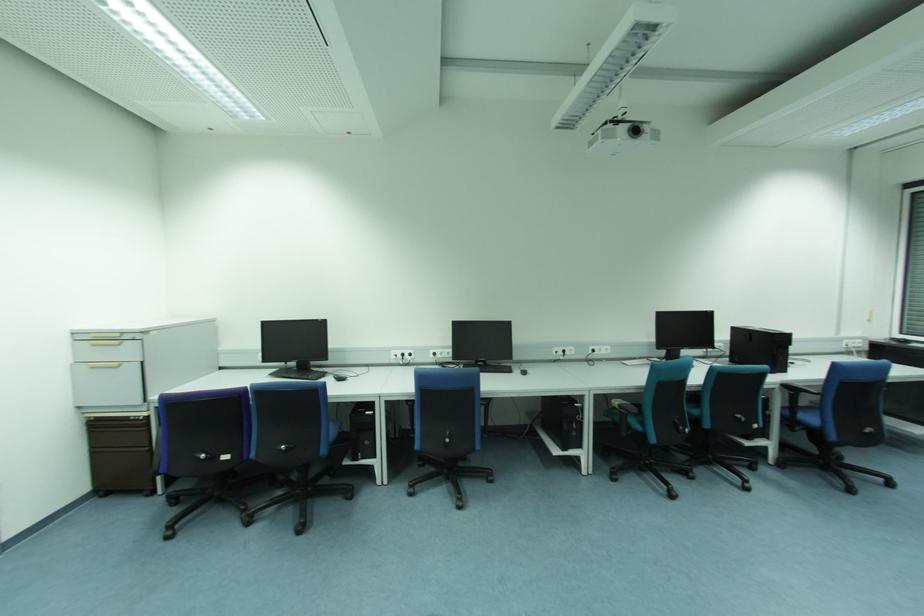
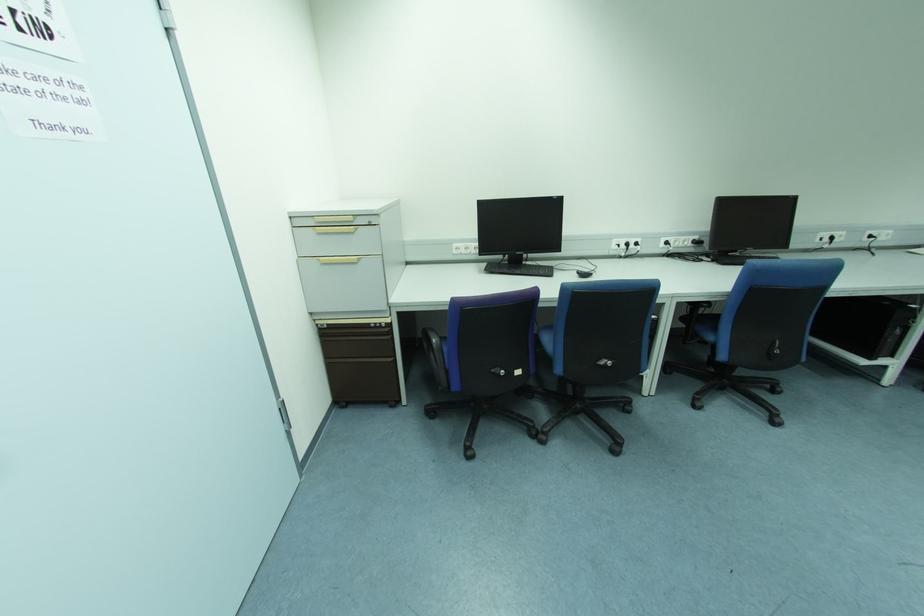
Locate, in the second image, the point that corresponds to point 335,379 in the first image.

(578, 276)